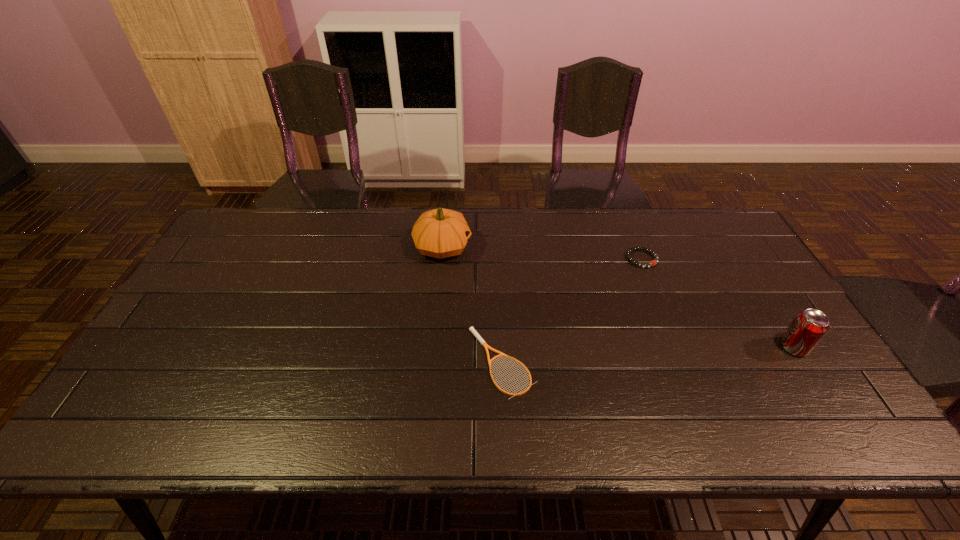
You are a GUI agent. You are given a task and a screenshot of the screen. Output one action in this format:
    pyautogui.click(x=<x>, y=<y>)
    Task: Click on the free location that satisfies the following two spatial constraints: 1. on the side of the tallest object with the carved face; 2. on the back side of the rightmost object
    This screenshot has height=540, width=960.
    Given the screenshot: What is the action you would take?
    pyautogui.click(x=433, y=347)